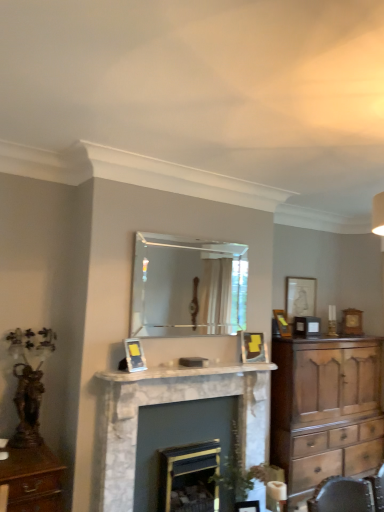
What do you see at coordinates (252, 347) in the screenshot? I see `matte gold picture frame at upper center, marked as the second picture frame in a front-to-back arrangement` at bounding box center [252, 347].

What is the approximate width of matte gold picture frame at center, the fourth picture frame in the right-to-left sequence?

matte gold picture frame at center, the fourth picture frame in the right-to-left sequence, is 14.19 centimeters in width.

What are the coordinates of `matte gold picture frame at center, the fourth picture frame in the right-to-left sequence` in the screenshot? It's located at (134, 355).

Image resolution: width=384 pixels, height=512 pixels. What are the coordinates of `clear glass mirror at center` in the screenshot? It's located at (187, 286).

Identify the location of white marble fireplace mantel at center. This screenshot has width=384, height=512. (184, 372).

Locate an element on the screen. Image resolution: width=384 pixels, height=512 pixels. wooden chest of drawers at right is located at coordinates pyautogui.click(x=326, y=409).

The image size is (384, 512). What are the coordinates of `matte gold picture frame at upper center, the third picture frame from the right` in the screenshot? It's located at (252, 347).

Measure the distance between clear glass mirror at center and matte gold picture frame at center, the 1th picture frame viewed from the left.

3.49 meters.

From a real-world perspective, who is located lower, clear glass mirror at center or matte gold picture frame at center, positioned as the 4th picture frame in back-to-front order?

From a 3D spatial view, matte gold picture frame at center, positioned as the 4th picture frame in back-to-front order, is below.

Find the location of a particular element. The width and height of the screenshot is (384, 512). the 4th picture frame positioned below the clear glass mirror at center (from a real-world perspective) is located at coordinates (134, 355).

Between clear glass mirror at center and matte gold picture frame at center, the fourth picture frame in the right-to-left sequence, which one appears on the right side from the viewer's perspective?

clear glass mirror at center.

Choose the correct answer: Is dark gray marble fireplace at center, arranged as the 2th fireplace when viewed from the left, inside matte gold picture frame at center, the fourth picture frame in the right-to-left sequence, or outside it?

The correct answer is: outside.

What's the angular difference between dark gray marble fireplace at center, which appears as the first fireplace when viewed from the right, and matte gold picture frame at center, the fourth picture frame in the right-to-left sequence,'s facing directions?

The angular difference between dark gray marble fireplace at center, which appears as the first fireplace when viewed from the right, and matte gold picture frame at center, the fourth picture frame in the right-to-left sequence, is 22.2 degrees.

Which of these two, dark gray marble fireplace at center, which appears as the first fireplace when viewed from the right, or matte gold picture frame at center, the 1th picture frame viewed from the left, stands shorter?

matte gold picture frame at center, the 1th picture frame viewed from the left, is shorter.

How distant is dark gray marble fireplace at center, which appears as the first fireplace when viewed from the right, from matte gold picture frame at center, positioned as the 4th picture frame in back-to-front order?

dark gray marble fireplace at center, which appears as the first fireplace when viewed from the right, is 90.15 centimeters from matte gold picture frame at center, positioned as the 4th picture frame in back-to-front order.

From the image's perspective, would you say marble fireplace at center, the second fireplace in the right-to-left sequence, is shown under matte gold picture frame at center, the fourth picture frame in the right-to-left sequence?

Yes, from the image's perspective, marble fireplace at center, the second fireplace in the right-to-left sequence, is beneath matte gold picture frame at center, the fourth picture frame in the right-to-left sequence.

Can you confirm if marble fireplace at center, acting as the 1th fireplace starting from the left, is taller than matte gold picture frame at center, positioned as the 4th picture frame in back-to-front order?

Indeed, marble fireplace at center, acting as the 1th fireplace starting from the left, has a greater height compared to matte gold picture frame at center, positioned as the 4th picture frame in back-to-front order.

Locate an element on the screen. The height and width of the screenshot is (512, 384). fireplace in front of the matte gold picture frame at center, which is counted as the first picture frame, starting from the front is located at coordinates (165, 403).

Is wooden chest of drawers at right shorter than matte gold picture frame at upper right, marked as the 3th picture frame in a left-to-right arrangement?

Incorrect, the height of wooden chest of drawers at right does not fall short of that of matte gold picture frame at upper right, marked as the 3th picture frame in a left-to-right arrangement.

Is wooden chest of drawers at right to the left or to the right of matte gold picture frame at upper right, the 3th picture frame viewed from the front, in the image?

Based on their positions, wooden chest of drawers at right is located to the right of matte gold picture frame at upper right, the 3th picture frame viewed from the front.

Could you tell me if wooden chest of drawers at right is facing matte gold picture frame at upper right, the 2th picture frame when ordered from back to front?

No, wooden chest of drawers at right does not turn towards matte gold picture frame at upper right, the 2th picture frame when ordered from back to front.

Which is correct: wooden chest of drawers at right is inside matte gold picture frame at upper right, the 2th picture frame when ordered from back to front, or outside of it?

wooden chest of drawers at right is outside matte gold picture frame at upper right, the 2th picture frame when ordered from back to front.

From the image's perspective, is matte gold picture frame at upper center, the 3th picture frame from the back, over matte silver picture frame at upper right, marked as the 4th picture frame in a front-to-back arrangement?

No, from the image's perspective, matte gold picture frame at upper center, the 3th picture frame from the back, is not above matte silver picture frame at upper right, marked as the 4th picture frame in a front-to-back arrangement.

Between matte gold picture frame at upper center, the 3th picture frame from the back, and matte silver picture frame at upper right, the 1th picture frame viewed from the back, which one appears on the right side from the viewer's perspective?

matte silver picture frame at upper right, the 1th picture frame viewed from the back, is more to the right.

Based on their sizes in the image, would you say matte gold picture frame at upper center, which appears as the 2th picture frame when viewed from the left, is bigger or smaller than matte silver picture frame at upper right, marked as the 4th picture frame in a front-to-back arrangement?

In the image, matte gold picture frame at upper center, which appears as the 2th picture frame when viewed from the left, appears to be smaller than matte silver picture frame at upper right, marked as the 4th picture frame in a front-to-back arrangement.

From a real-world perspective, is matte gold picture frame at upper center, the third picture frame from the right, physically located above or below matte silver picture frame at upper right, the 1th picture frame viewed from the back?

matte gold picture frame at upper center, the third picture frame from the right, is below matte silver picture frame at upper right, the 1th picture frame viewed from the back.

From a real-world perspective, who is located lower, matte gold picture frame at center, which is counted as the first picture frame, starting from the front, or white marble fireplace mantel at center?

From a 3D spatial view, white marble fireplace mantel at center is below.

Is matte gold picture frame at center, the fourth picture frame in the right-to-left sequence, not near white marble fireplace mantel at center?

No.

Is matte gold picture frame at center, which is counted as the first picture frame, starting from the front, thinner than white marble fireplace mantel at center?

Yes.

This screenshot has width=384, height=512. I want to click on mantle below the matte gold picture frame at center, positioned as the 4th picture frame in back-to-front order (from the image's perspective), so click(x=184, y=372).

Considering the relative sizes of marble fireplace at center, acting as the 1th fireplace starting from the left, and matte gold picture frame at upper center, the third picture frame from the right, in the image provided, is marble fireplace at center, acting as the 1th fireplace starting from the left, thinner than matte gold picture frame at upper center, the third picture frame from the right,?

No.

Do you think marble fireplace at center, acting as the 1th fireplace starting from the left, is within matte gold picture frame at upper center, the third picture frame from the right, or outside of it?

marble fireplace at center, acting as the 1th fireplace starting from the left, is not inside matte gold picture frame at upper center, the third picture frame from the right, it's outside.

Is marble fireplace at center, the second fireplace in the right-to-left sequence, oriented towards matte gold picture frame at upper center, the 3th picture frame from the back?

No, marble fireplace at center, the second fireplace in the right-to-left sequence, is not oriented towards matte gold picture frame at upper center, the 3th picture frame from the back.

The image size is (384, 512). Find the location of `mirror above the matte gold picture frame at center, which is counted as the first picture frame, starting from the front (from a real-world perspective)`. mirror above the matte gold picture frame at center, which is counted as the first picture frame, starting from the front (from a real-world perspective) is located at coordinates (187, 286).

Find the location of a particular element. This screenshot has height=512, width=384. fireplace behind the matte gold picture frame at center, the 1th picture frame viewed from the left is located at coordinates (189, 477).

From the image, which object appears to be nearer to matte gold picture frame at upper center, the 3th picture frame from the back, matte gold picture frame at upper right, the 3th picture frame viewed from the front, or marble fireplace at center, acting as the 1th fireplace starting from the left?

matte gold picture frame at upper right, the 3th picture frame viewed from the front, is closer to matte gold picture frame at upper center, the 3th picture frame from the back.

Estimate the real-world distances between objects in this image. Which object is further from matte silver picture frame at upper right, marked as the 4th picture frame in a front-to-back arrangement, marble fireplace at center, the second fireplace in the right-to-left sequence, or white marble fireplace mantel at center?

marble fireplace at center, the second fireplace in the right-to-left sequence.

Looking at the image, which one is located further to white marble fireplace mantel at center, matte gold picture frame at center, the 1th picture frame viewed from the left, or clear glass mirror at center?

clear glass mirror at center.

Which object lies nearer to the anchor point matte gold picture frame at upper right, the 3th picture frame viewed from the front, clear glass mirror at center or matte gold picture frame at upper center, the 3th picture frame from the back?

matte gold picture frame at upper center, the 3th picture frame from the back, is positioned closer to the anchor matte gold picture frame at upper right, the 3th picture frame viewed from the front.

Based on their spatial positions, is matte silver picture frame at upper right, the 1th picture frame viewed from the back, or matte gold picture frame at upper right, the second picture frame viewed from the right, closer to matte gold picture frame at center, which is counted as the first picture frame, starting from the front?

matte gold picture frame at upper right, the second picture frame viewed from the right, is closer to matte gold picture frame at center, which is counted as the first picture frame, starting from the front.

Based on the photo, considering their positions, is matte silver picture frame at upper right, the 1th picture frame viewed from the back, positioned closer to wooden chest of drawers at right than matte gold picture frame at center, the 1th picture frame viewed from the left?

matte silver picture frame at upper right, the 1th picture frame viewed from the back, is positioned closer to the anchor wooden chest of drawers at right.

Based on their spatial positions, is matte gold picture frame at upper right, the 3th picture frame viewed from the front, or matte silver picture frame at upper right, the 1th picture frame viewed from the back, further from matte gold picture frame at center, positioned as the 4th picture frame in back-to-front order?

Among the two, matte silver picture frame at upper right, the 1th picture frame viewed from the back, is located further to matte gold picture frame at center, positioned as the 4th picture frame in back-to-front order.

Looking at the image, which one is located further to wooden chest of drawers at right, clear glass mirror at center or white marble fireplace mantel at center?

clear glass mirror at center is further to wooden chest of drawers at right.

The image size is (384, 512). What are the coordinates of `picture frame between matte gold picture frame at upper center, marked as the second picture frame in a front-to-back arrangement, and matte silver picture frame at upper right, the 1th picture frame viewed from the back, from front to back` in the screenshot? It's located at (282, 323).

You are a GUI agent. You are given a task and a screenshot of the screen. Output one action in this format:
    pyautogui.click(x=<x>, y=<y>)
    Task: Click on the mirror between marble fireplace at center, acting as the 1th fireplace starting from the left, and matte silver picture frame at upper right, which appears as the first picture frame when viewed from the right, from front to back
    The image size is (384, 512).
    Given the screenshot: What is the action you would take?
    pyautogui.click(x=187, y=286)

You are a GUI agent. You are given a task and a screenshot of the screen. Output one action in this format:
    pyautogui.click(x=<x>, y=<y>)
    Task: Click on the fireplace positioned between white marble fireplace mantel at center and matte gold picture frame at upper right, marked as the 3th picture frame in a left-to-right arrangement, from near to far
    This screenshot has width=384, height=512.
    Given the screenshot: What is the action you would take?
    pyautogui.click(x=189, y=477)

Find the location of `mantle between matte gold picture frame at center, the 1th picture frame viewed from the left, and marble fireplace at center, the second fireplace in the right-to-left sequence, in the up-down direction`. mantle between matte gold picture frame at center, the 1th picture frame viewed from the left, and marble fireplace at center, the second fireplace in the right-to-left sequence, in the up-down direction is located at coordinates (184, 372).